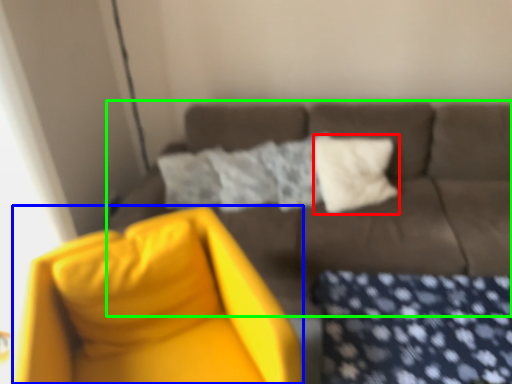
Question: Considering the real-world distances, which object is farthest from pillow (highlighted by a red box)? swivel chair (highlighted by a blue box) or studio couch (highlighted by a green box)?

Choices:
 (A) swivel chair
 (B) studio couch

Answer: (A)